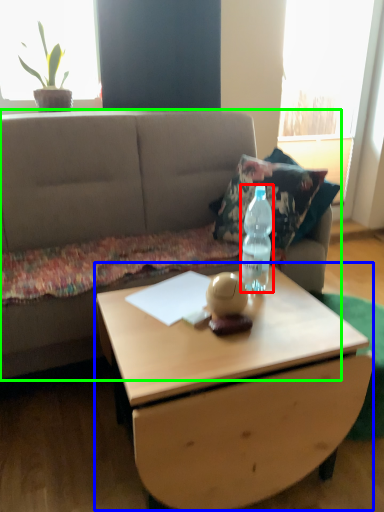
Question: Considering the real-world distances, which object is closest to bottle (highlighted by a red box)? coffee table (highlighted by a blue box) or studio couch (highlighted by a green box).

Choices:
 (A) coffee table
 (B) studio couch

Answer: (A)